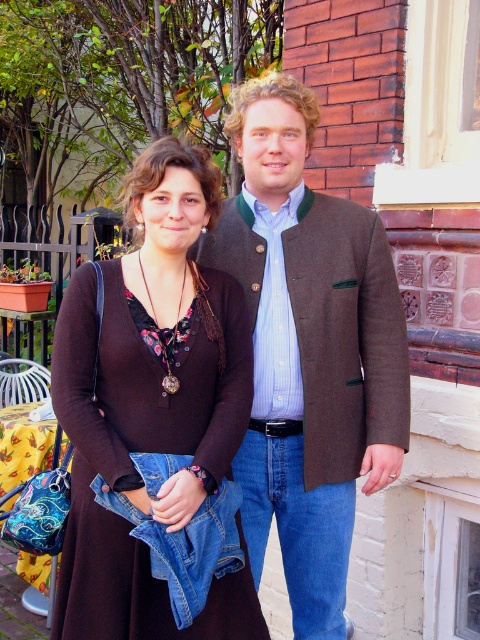
Which is above, brown woolen jacket at center or brown fabric dress at center?

brown woolen jacket at center

How far apart are brown woolen jacket at center and brown fabric dress at center?

brown woolen jacket at center and brown fabric dress at center are 14.57 inches apart from each other.

Locate an element on the screen. This screenshot has height=640, width=480. brown woolen jacket at center is located at coordinates tap(309, 349).